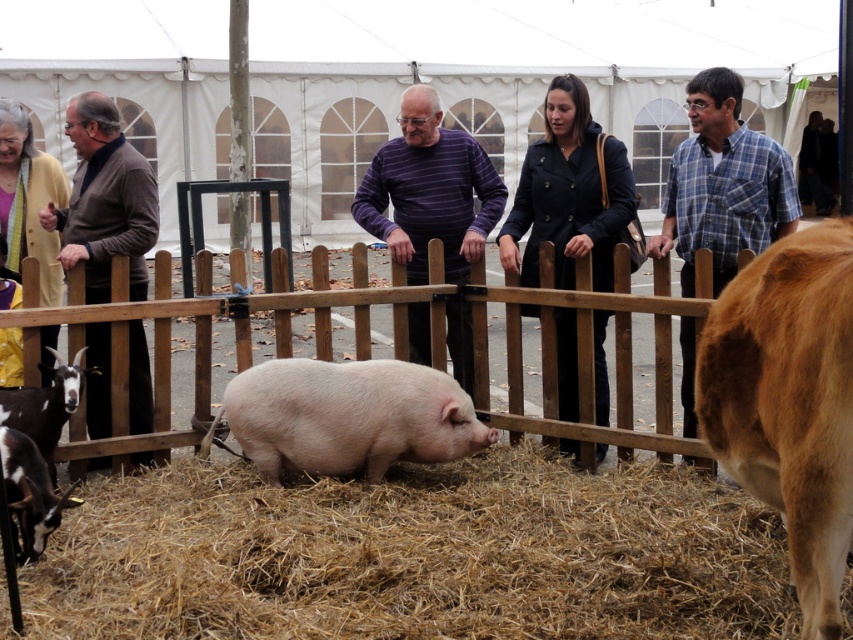
You are standing at the entrance of the fairground and see the pink matte pig at center and the purple striped sweater at center. Which object is closer to you?

The pink matte pig at center is closer to you because it is in front of the purple striped sweater at center.

You are a photographer trying to capture a photo of both the pink matte pig at center and the purple striped sweater at center. Which object should you focus on first if you want to ensure both are in the frame without moving the camera?

You should focus on the pink matte pig at center first because it is wider than the purple striped sweater at center, so centering it will ensure the sweater also fits in the frame.

You are standing in front of the fence at the fair and want to determine which of the two points, point (372, 481) or point (125, 243), is nearer to you. Can you figure out which one is closer?

Point (372, 481) is closer to the viewer than point (125, 243).